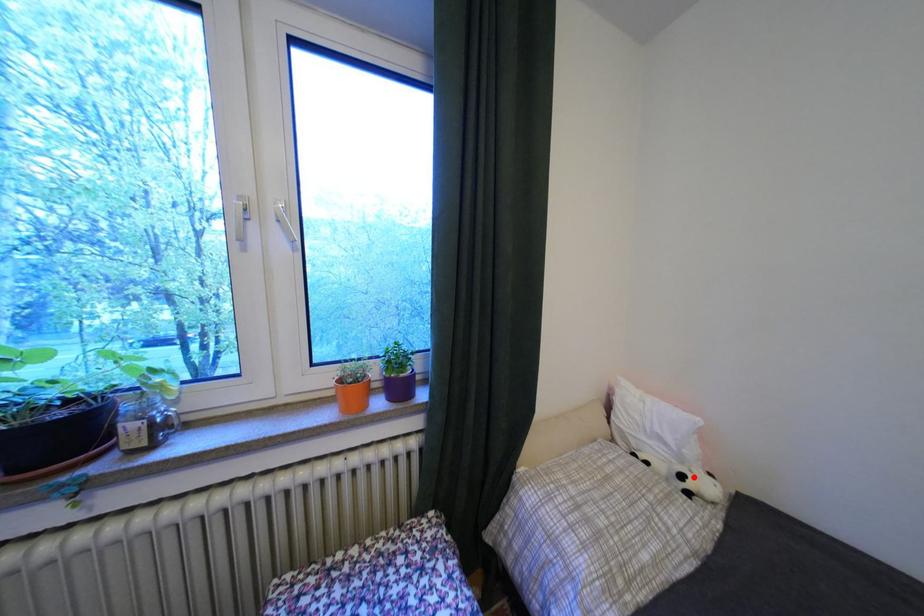
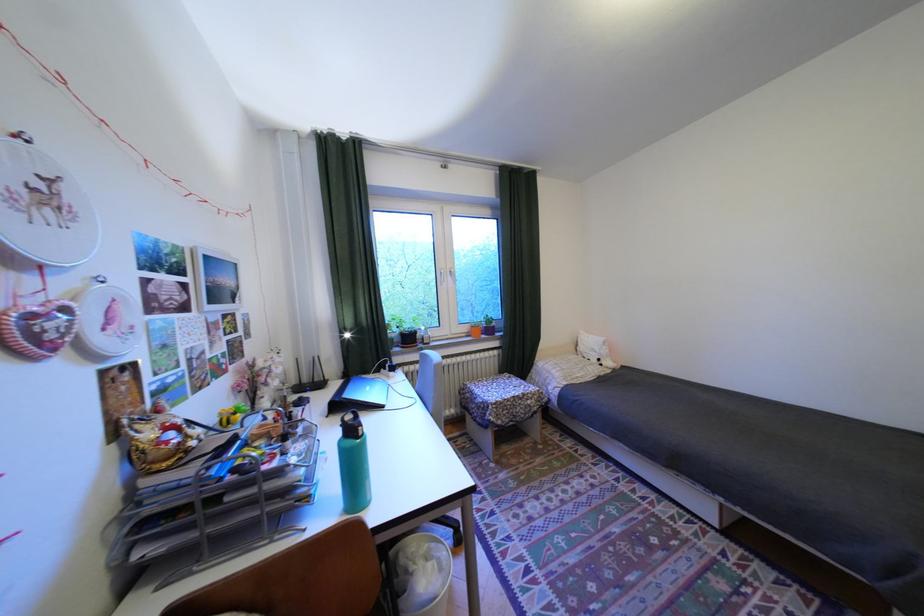
The point at the highlighted location is marked in the first image. Where is the corresponding point in the second image?

(611, 360)